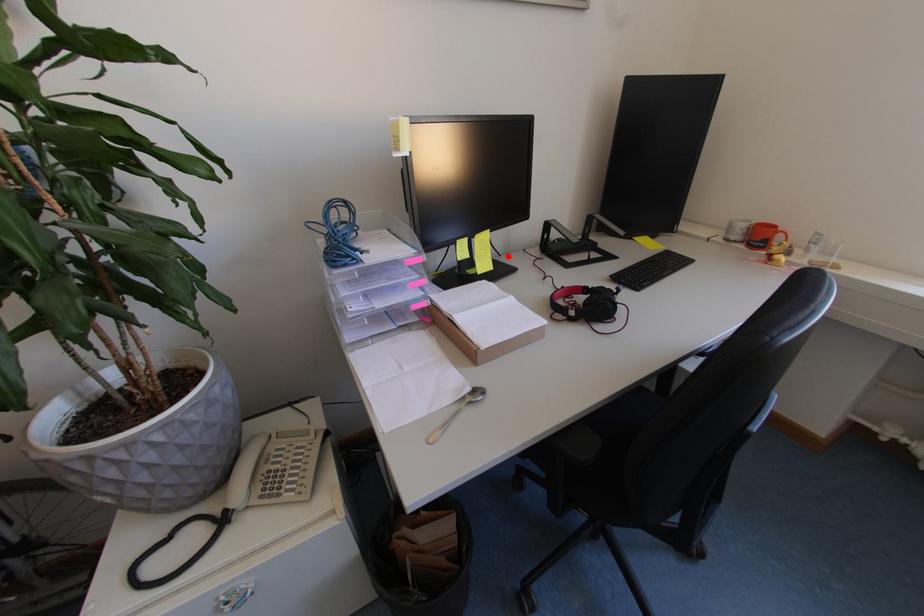
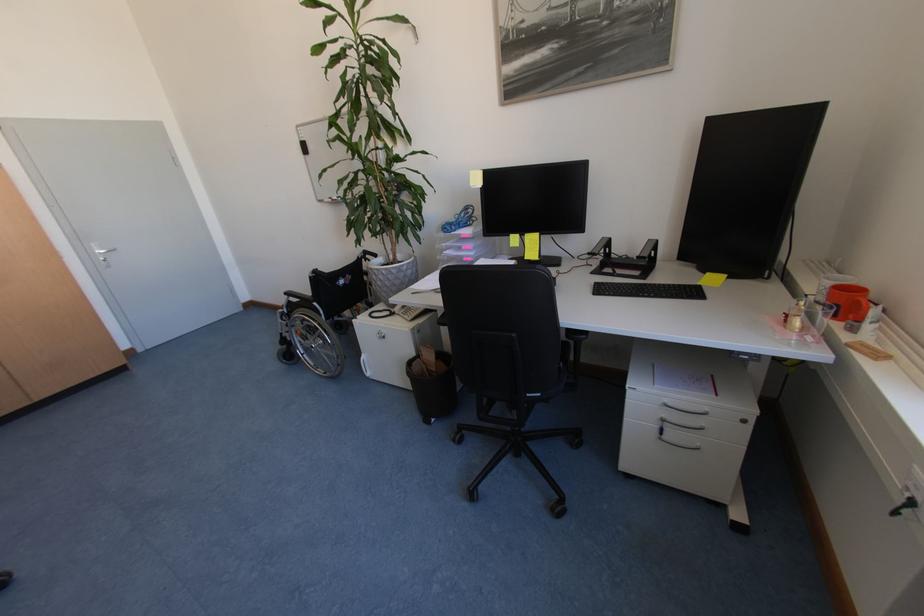
Where in the second image is the point corresponding to the highlighted location from the first image?

(581, 259)